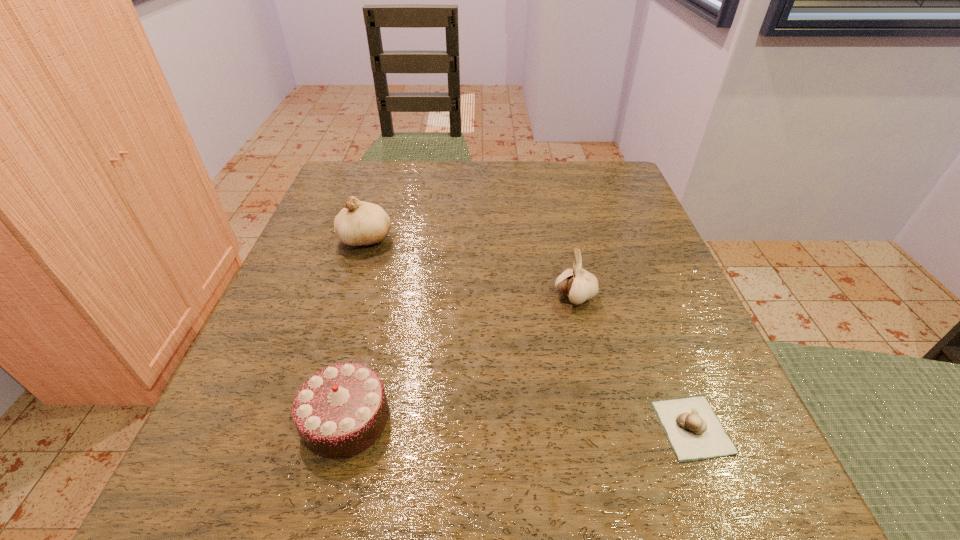
Locate an element on the screen. The width and height of the screenshot is (960, 540). free space at the right edge of the desktop is located at coordinates (681, 288).

Identify the location of vacant point at the far left corner. (365, 191).

Find the location of `vacant space at the near right corner`. vacant space at the near right corner is located at coordinates (729, 470).

Locate an element on the screen. Image resolution: width=960 pixels, height=540 pixels. free area in between the second tallest object and the rightmost garlic is located at coordinates (634, 362).

At what (x,y) coordinates should I click in order to perform the action: click on vacant space in between the farthest object and the third tallest object. Please return your answer as a coordinate pair (x, y). Image resolution: width=960 pixels, height=540 pixels. Looking at the image, I should click on (355, 329).

Find the location of a particular element. The height and width of the screenshot is (540, 960). vacant space that is in between the farthest object and the second object from right to left is located at coordinates (469, 268).

Identify the location of unoccupied area between the farthest garlic and the second farthest object. The image size is (960, 540). (469, 268).

This screenshot has width=960, height=540. In order to click on unoccupied position between the farthest object and the second garlic from left to right in this screenshot , I will do `click(469, 268)`.

Find the location of a particular element. Image resolution: width=960 pixels, height=540 pixels. empty location between the chocolate cake and the shortest garlic is located at coordinates (519, 423).

This screenshot has height=540, width=960. I want to click on empty space between the shortest object and the chocolate cake, so click(519, 423).